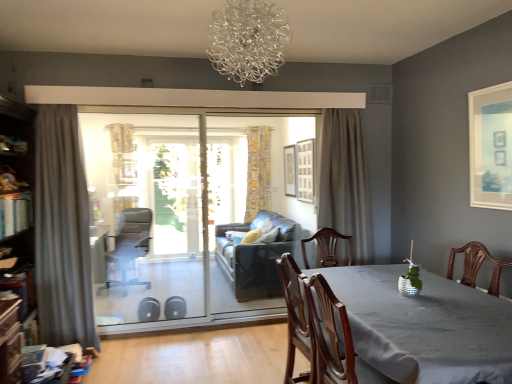
I want to click on yellow floral fabric curtain at center, positioned as the third curtain in front-to-back order, so click(x=258, y=171).

What do you see at coordinates (290, 170) in the screenshot?
I see `matte white picture frame at center, positioned as the third picture frame in front-to-back order` at bounding box center [290, 170].

What do you see at coordinates (62, 231) in the screenshot?
I see `gray fabric curtain at left, acting as the third curtain starting from the right` at bounding box center [62, 231].

Image resolution: width=512 pixels, height=384 pixels. In order to click on gray fabric curtain at left, acting as the 3th curtain starting from the back in this screenshot , I will do `click(62, 231)`.

The image size is (512, 384). I want to click on leather couch at center, so click(x=256, y=257).

The image size is (512, 384). Describe the element at coordinates (18, 199) in the screenshot. I see `wooden bookshelf at left` at that location.

What is the approximate width of gray textured curtain at center, placed as the second curtain when sorted from back to front?

gray textured curtain at center, placed as the second curtain when sorted from back to front, is 11.60 inches wide.

At what (x,y) coordinates should I click in order to perform the action: click on transparent glass door at center. Please return your answer as a coordinate pair (x, y). This screenshot has height=384, width=512. Looking at the image, I should click on (190, 216).

Who is smaller, matte white picture frame at center, the first picture frame positioned from the back, or leather swivel chair at left?

With smaller size is matte white picture frame at center, the first picture frame positioned from the back.

Where is `the 2nd picture frame positioned above the leather swivel chair at left (from the image's perspective)`? the 2nd picture frame positioned above the leather swivel chair at left (from the image's perspective) is located at coordinates pos(290,170).

Measure the distance between matte white picture frame at center, the first picture frame positioned from the back, and leather swivel chair at left.

matte white picture frame at center, the first picture frame positioned from the back, and leather swivel chair at left are 2.11 meters apart from each other.

Is matte white picture frame at center, arranged as the 3th picture frame when viewed from the right, not near leather swivel chair at left?

Yes, matte white picture frame at center, arranged as the 3th picture frame when viewed from the right, is far from leather swivel chair at left.

From the image's perspective, is wooden bookshelf at left located beneath gray textured curtain at center, acting as the 2th curtain starting from the front?

Yes, from the image's perspective, wooden bookshelf at left is below gray textured curtain at center, acting as the 2th curtain starting from the front.

Considering the relative sizes of wooden bookshelf at left and gray textured curtain at center, arranged as the 3th curtain when viewed from the left, in the image provided, is wooden bookshelf at left bigger than gray textured curtain at center, arranged as the 3th curtain when viewed from the left,?

Yes, wooden bookshelf at left is bigger than gray textured curtain at center, arranged as the 3th curtain when viewed from the left.

Consider the image. Which is closer to the camera, (35, 304) or (338, 144)?

Positioned in front is point (35, 304).

Between point (266, 190) and point (296, 181), which one is positioned in front?

The point (296, 181) is in front.

Considering the relative positions of yellow floral fabric curtain at center, positioned as the third curtain in front-to-back order, and matte white picture frame at center, which is counted as the 1th picture frame, starting from the left, in the image provided, is yellow floral fabric curtain at center, positioned as the third curtain in front-to-back order, behind matte white picture frame at center, which is counted as the 1th picture frame, starting from the left,?

Yes, the depth of yellow floral fabric curtain at center, positioned as the third curtain in front-to-back order, is greater than that of matte white picture frame at center, which is counted as the 1th picture frame, starting from the left.

Considering the relative sizes of yellow floral fabric curtain at center, positioned as the third curtain in front-to-back order, and matte white picture frame at center, the first picture frame positioned from the back, in the image provided, is yellow floral fabric curtain at center, positioned as the third curtain in front-to-back order, thinner than matte white picture frame at center, the first picture frame positioned from the back,?

No.

From the image's perspective, who appears lower, yellow floral fabric curtain at center, positioned as the second curtain in left-to-right order, or matte white picture frame at center, positioned as the third picture frame in front-to-back order?

From the image's view, yellow floral fabric curtain at center, positioned as the second curtain in left-to-right order, is below.

Relative to wooden picture frame at center, marked as the 2th picture frame in a right-to-left arrangement, is wooden chair at center in front or behind?

wooden chair at center is positioned closer to the viewer than wooden picture frame at center, marked as the 2th picture frame in a right-to-left arrangement.

Considering the sizes of objects wooden chair at center and wooden picture frame at center, placed as the 2th picture frame when sorted from front to back, in the image provided, who is bigger, wooden chair at center or wooden picture frame at center, placed as the 2th picture frame when sorted from front to back,?

wooden chair at center.

Considering the relative sizes of wooden chair at center and wooden picture frame at center, the second picture frame viewed from the back, in the image provided, is wooden chair at center shorter than wooden picture frame at center, the second picture frame viewed from the back,?

Incorrect, the height of wooden chair at center does not fall short of that of wooden picture frame at center, the second picture frame viewed from the back.

Considering the relative sizes of wooden chair at center and wooden picture frame at center, marked as the 2th picture frame in a right-to-left arrangement, in the image provided, is wooden chair at center thinner than wooden picture frame at center, marked as the 2th picture frame in a right-to-left arrangement,?

Incorrect, the width of wooden chair at center is not less than that of wooden picture frame at center, marked as the 2th picture frame in a right-to-left arrangement.

Considering the relative sizes of yellow floral fabric curtain at center, the first curtain positioned from the back, and wooden chair at center in the image provided, is yellow floral fabric curtain at center, the first curtain positioned from the back, wider than wooden chair at center?

Incorrect, the width of yellow floral fabric curtain at center, the first curtain positioned from the back, does not surpass that of wooden chair at center.

From a real-world perspective, is yellow floral fabric curtain at center, the second curtain in the right-to-left sequence, positioned under wooden chair at center based on gravity?

No.

Can you tell me how much yellow floral fabric curtain at center, positioned as the third curtain in front-to-back order, and wooden chair at center differ in facing direction?

The facing directions of yellow floral fabric curtain at center, positioned as the third curtain in front-to-back order, and wooden chair at center are 89.1 degrees apart.

Where is `studio couch below the matte white picture frame at upper right, the 3th picture frame positioned from the back (from the image's perspective)`? This screenshot has width=512, height=384. studio couch below the matte white picture frame at upper right, the 3th picture frame positioned from the back (from the image's perspective) is located at coordinates (256, 257).

Is matte white picture frame at upper right, the 3th picture frame positioned from the back, positioned with its back to leather couch at center?

No, matte white picture frame at upper right, the 3th picture frame positioned from the back, is not facing the opposite direction of leather couch at center.

Between matte white picture frame at upper right, the first picture frame positioned from the right, and leather couch at center, which one has more height?

Standing taller between the two is leather couch at center.

Visually, is matte white picture frame at upper right, the first picture frame when ordered from front to back, positioned to the left or to the right of leather couch at center?

matte white picture frame at upper right, the first picture frame when ordered from front to back, is to the right of leather couch at center.

Are wooden picture frame at center, placed as the 2th picture frame when sorted from front to back, and wooden bookshelf at left making contact?

No, wooden picture frame at center, placed as the 2th picture frame when sorted from front to back, is not beside wooden bookshelf at left.

From a real-world perspective, who is located higher, wooden picture frame at center, the second picture frame viewed from the back, or wooden bookshelf at left?

wooden picture frame at center, the second picture frame viewed from the back.

Between wooden picture frame at center, the second picture frame positioned from the left, and wooden bookshelf at left, which one has more height?

wooden bookshelf at left is taller.

Does wooden picture frame at center, the second picture frame positioned from the left, appear on the right side of wooden bookshelf at left?

Correct, you'll find wooden picture frame at center, the second picture frame positioned from the left, to the right of wooden bookshelf at left.

Image resolution: width=512 pixels, height=384 pixels. Find the location of `swivel chair directly beneath the matte white picture frame at center, the first picture frame positioned from the back (from a real-world perspective)`. swivel chair directly beneath the matte white picture frame at center, the first picture frame positioned from the back (from a real-world perspective) is located at coordinates 129,247.

Locate an element on the screen. This screenshot has height=384, width=512. the 2nd curtain above the wooden bookshelf at left (from the image's perspective) is located at coordinates (345, 182).

When comparing their distances from matte white picture frame at upper right, the first picture frame when ordered from front to back, does gray fabric curtain at left, the first curtain when ordered from front to back, or matte white picture frame at center, arranged as the 3th picture frame when viewed from the right, seem closer?

Based on the image, matte white picture frame at center, arranged as the 3th picture frame when viewed from the right, appears to be nearer to matte white picture frame at upper right, the first picture frame when ordered from front to back.

Which object lies nearer to the anchor point wooden picture frame at center, marked as the 2th picture frame in a right-to-left arrangement, clear glass chandelier at upper center or transparent glass door at center?

Among the two, transparent glass door at center is located nearer to wooden picture frame at center, marked as the 2th picture frame in a right-to-left arrangement.

Which object lies nearer to the anchor point matte white picture frame at upper right, the first picture frame when ordered from front to back, clear glass chandelier at upper center or wooden picture frame at center, the second picture frame viewed from the back?

The object closer to matte white picture frame at upper right, the first picture frame when ordered from front to back, is clear glass chandelier at upper center.

Based on their spatial positions, is leather swivel chair at left or matte white picture frame at center, the first picture frame positioned from the back, closer to yellow floral fabric curtain at center, positioned as the third curtain in front-to-back order?

Among the two, matte white picture frame at center, the first picture frame positioned from the back, is located nearer to yellow floral fabric curtain at center, positioned as the third curtain in front-to-back order.

Considering their positions, is gray fabric curtain at left, positioned as the first curtain in left-to-right order, positioned further to wooden bookshelf at left than wooden chair at center?

wooden chair at center.

Considering their positions, is smooth gray table at center positioned further to gray fabric curtain at left, positioned as the first curtain in left-to-right order, than leather swivel chair at left?

Among the two, smooth gray table at center is located further to gray fabric curtain at left, positioned as the first curtain in left-to-right order.

Looking at the image, which one is located closer to transparent glass door at center, gray fabric curtain at left, positioned as the first curtain in left-to-right order, or leather couch at center?

leather couch at center is positioned closer to the anchor transparent glass door at center.

When comparing their distances from smooth gray table at center, does wooden picture frame at center, the second picture frame positioned from the left, or gray textured curtain at center, acting as the 2th curtain starting from the front, seem closer?

gray textured curtain at center, acting as the 2th curtain starting from the front, is positioned closer to the anchor smooth gray table at center.

Find the location of a particular element. The height and width of the screenshot is (384, 512). screen door between wooden bookshelf at left and yellow floral fabric curtain at center, positioned as the third curtain in front-to-back order, from front to back is located at coordinates [x=147, y=216].

Where is `studio couch situated between transparent glass door at center and gray textured curtain at center, acting as the 2th curtain starting from the front, from left to right`? This screenshot has height=384, width=512. studio couch situated between transparent glass door at center and gray textured curtain at center, acting as the 2th curtain starting from the front, from left to right is located at coordinates (256, 257).

Locate an element on the screen. The image size is (512, 384). swivel chair between gray fabric curtain at left, positioned as the first curtain in left-to-right order, and matte white picture frame at center, the first picture frame positioned from the back, from front to back is located at coordinates (129, 247).

I want to click on door between leather swivel chair at left and matte white picture frame at upper right, the first picture frame when ordered from front to back, in the horizontal direction, so click(190, 216).